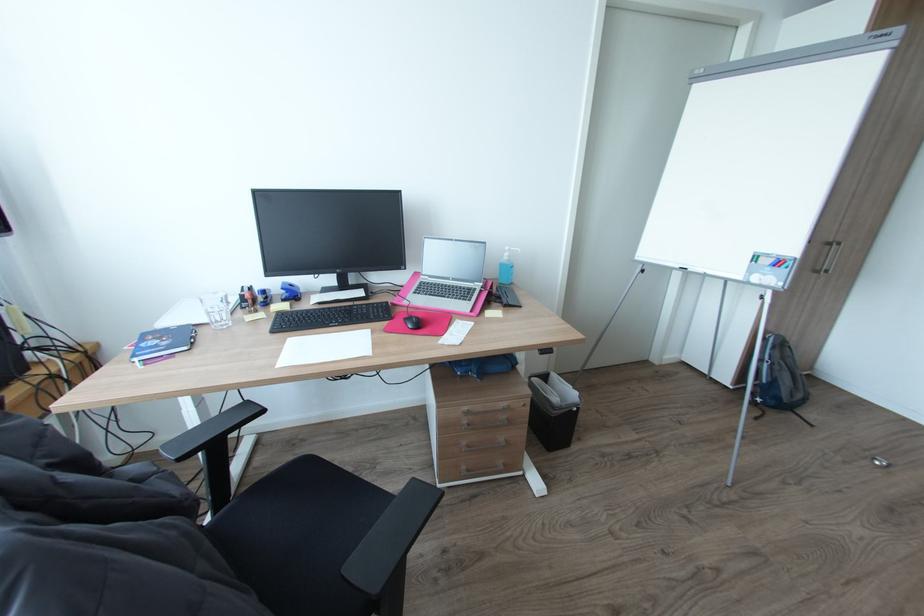
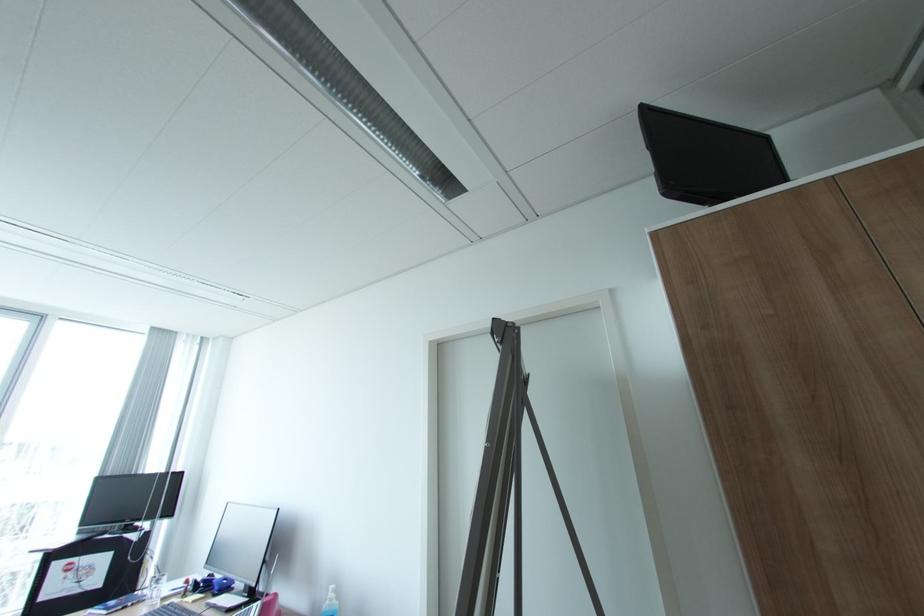
The point at (514, 256) is marked in the first image. Where is the corresponding point in the second image?

(336, 599)